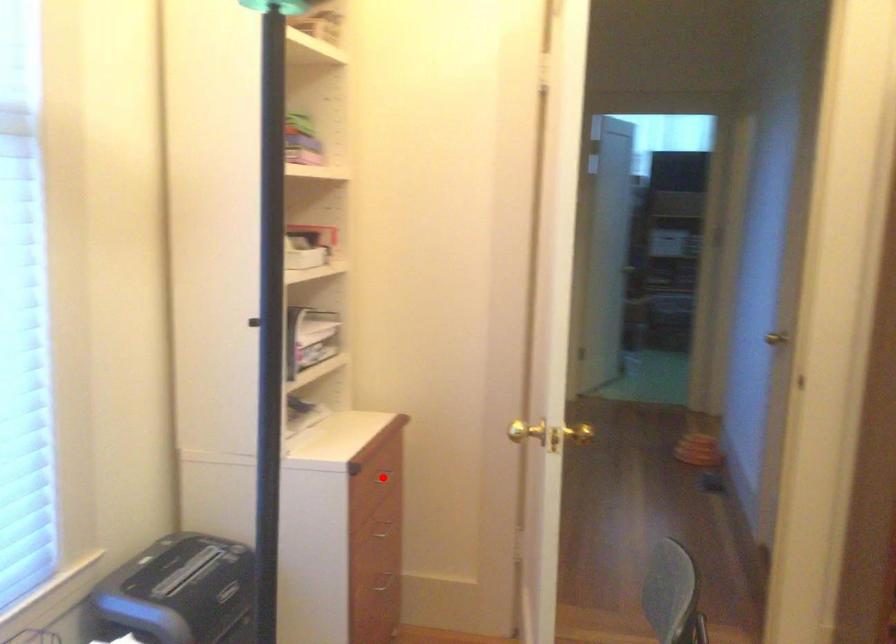
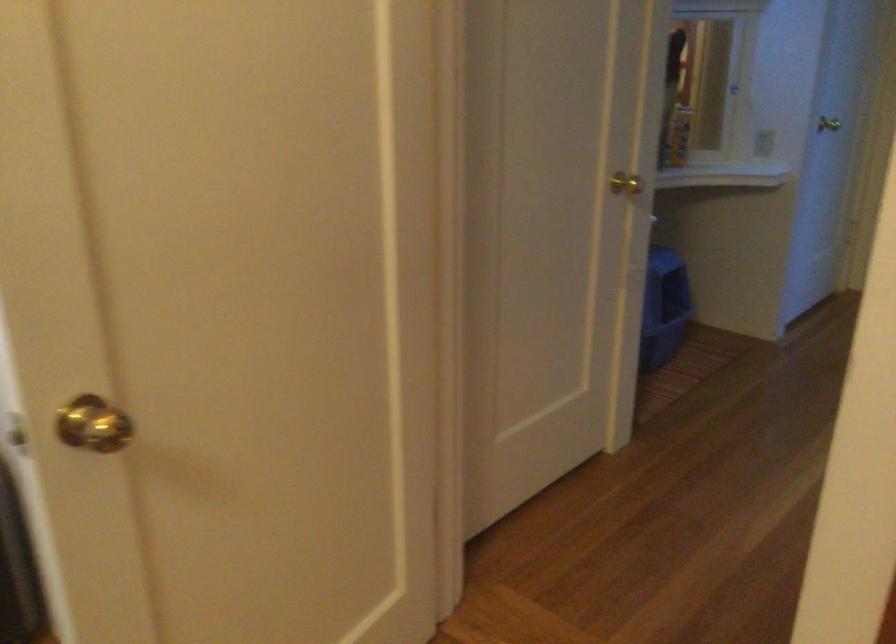
Question: I am providing you with two images of the same scene from different viewpoints. A red point is marked on the first image. Is the red point's position out of view in image 2?

Choices:
 (A) Yes
 (B) No

Answer: (A)